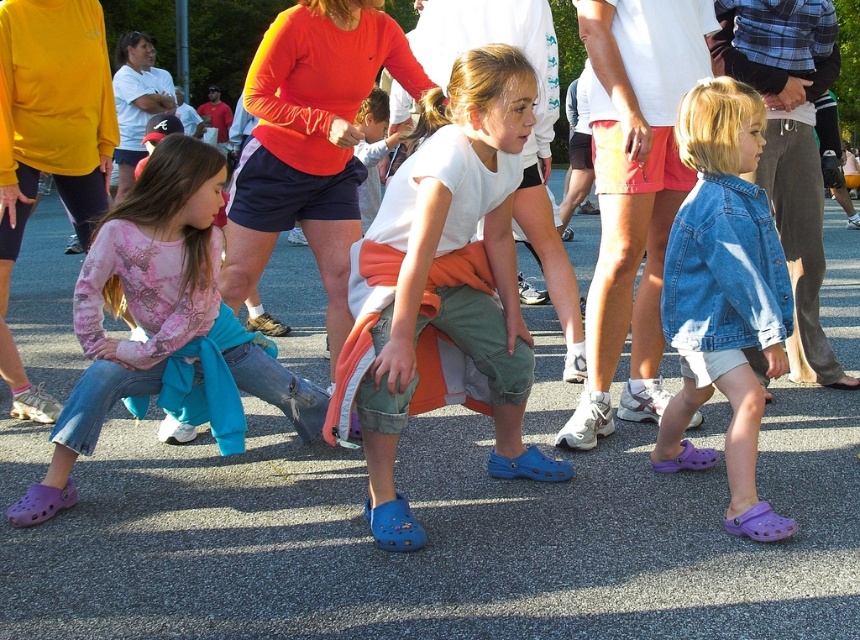
Question: Can you confirm if denim jacket at lower right is thinner than denim shorts at center?

Choices:
 (A) yes
 (B) no

Answer: (A)

Question: Which point is closer to the camera?

Choices:
 (A) purple croc shoes at lower left
 (B) matte orange shirt at center
 (C) white matte shirt at center

Answer: (C)

Question: Does white matte shirt at center appear over matte orange shirt at center?

Choices:
 (A) yes
 (B) no

Answer: (B)

Question: Which point is closer to the camera taking this photo?

Choices:
 (A) (274, 163)
 (B) (514, 316)
 (C) (763, 269)
 (D) (668, 33)

Answer: (C)

Question: Can you confirm if white matte shirt at center is positioned above denim shorts at center?

Choices:
 (A) no
 (B) yes

Answer: (A)

Question: Which object is positioned farthest from the matte orange shirt at center?

Choices:
 (A) purple croc shoes at lower left
 (B) white matte shirt at center

Answer: (B)